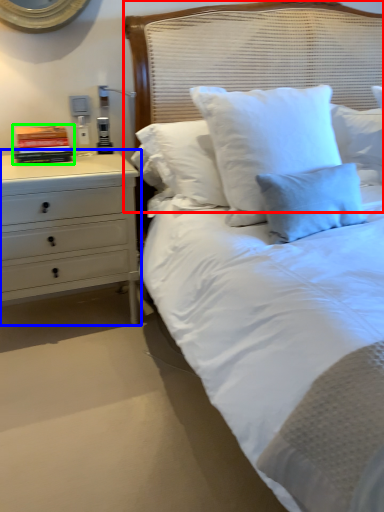
Question: Based on their relative distances, which object is nearer to headboard (highlighted by a red box)? Choose from chest of drawers (highlighted by a blue box) and book (highlighted by a green box).

Choices:
 (A) chest of drawers
 (B) book

Answer: (A)